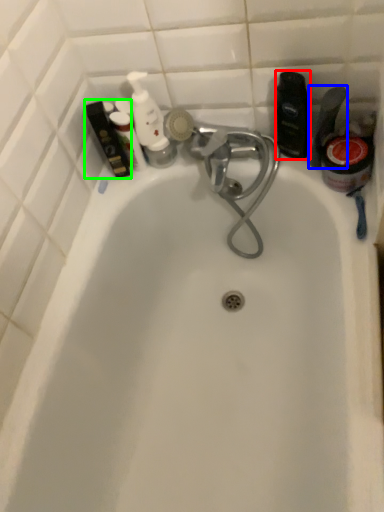
Question: Which object is the closest to the toiletry (highlighted by a red box)? Choose among these: toiletry (highlighted by a blue box) or toiletry (highlighted by a green box).

Choices:
 (A) toiletry
 (B) toiletry

Answer: (A)